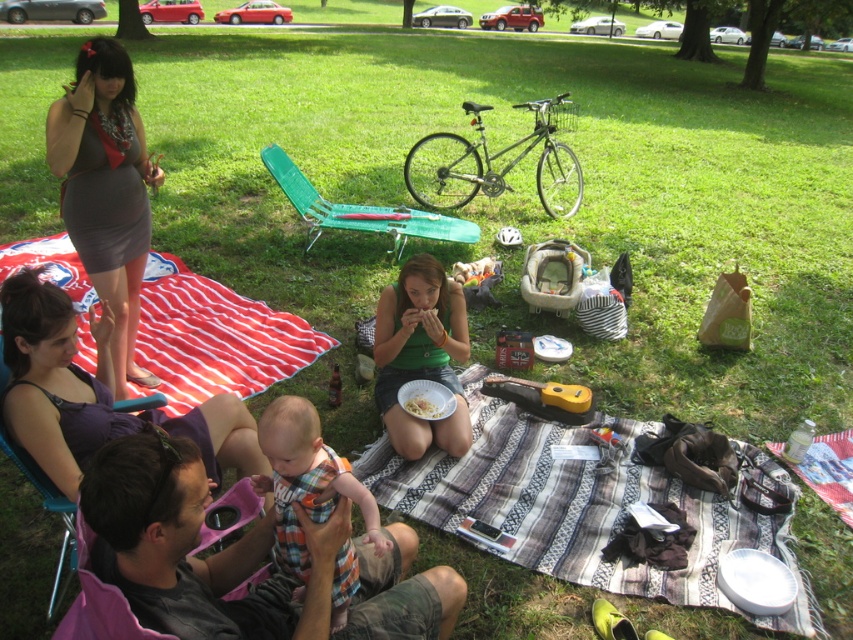
Question: Considering the relative positions of gray fabric shirt at center and matte gray dress at upper left in the image provided, where is gray fabric shirt at center located with respect to matte gray dress at upper left?

Choices:
 (A) below
 (B) above

Answer: (A)

Question: Does red striped picnic blanket at upper left appear on the left side of plaid fabric baby at center?

Choices:
 (A) no
 (B) yes

Answer: (B)

Question: Which point is farther from the camera taking this photo?

Choices:
 (A) (286, 580)
 (B) (300, 588)
 (C) (432, 401)

Answer: (C)

Question: Which point is closer to the camera?

Choices:
 (A) green grass at center
 (B) red striped picnic blanket at upper left

Answer: (B)

Question: Is gray fabric shirt at center behind green matte shirt at center?

Choices:
 (A) no
 (B) yes

Answer: (A)

Question: Which object is the closest to the plaid fabric baby at center?

Choices:
 (A) purple fabric dress at upper left
 (B) white matte paper plate at center
 (C) matte gray dress at upper left

Answer: (A)